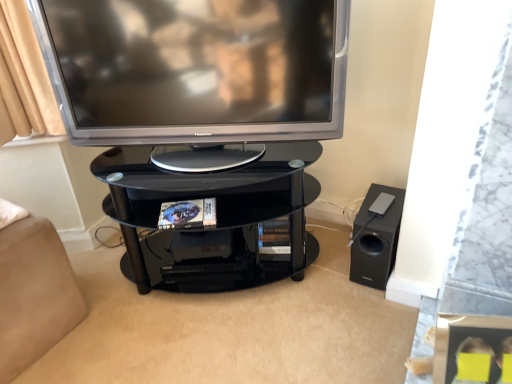
Question: Is black glass shelf at center taller or shorter than beige fabric bed at lower left?

Choices:
 (A) tall
 (B) short

Answer: (A)

Question: Considering the positions of black glass shelf at center and beige fabric bed at lower left in the image, is black glass shelf at center wider or thinner than beige fabric bed at lower left?

Choices:
 (A) wide
 (B) thin

Answer: (A)

Question: Which object is the closest to the beige fabric bed at lower left?

Choices:
 (A) satin silver television at upper center
 (B) black glass shelf at center
 (C) black matte speaker at lower right

Answer: (B)

Question: Estimate the real-world distances between objects in this image. Which object is closer to the beige fabric bed at lower left?

Choices:
 (A) black glass shelf at center
 (B) satin silver television at upper center
 (C) black matte speaker at lower right

Answer: (A)